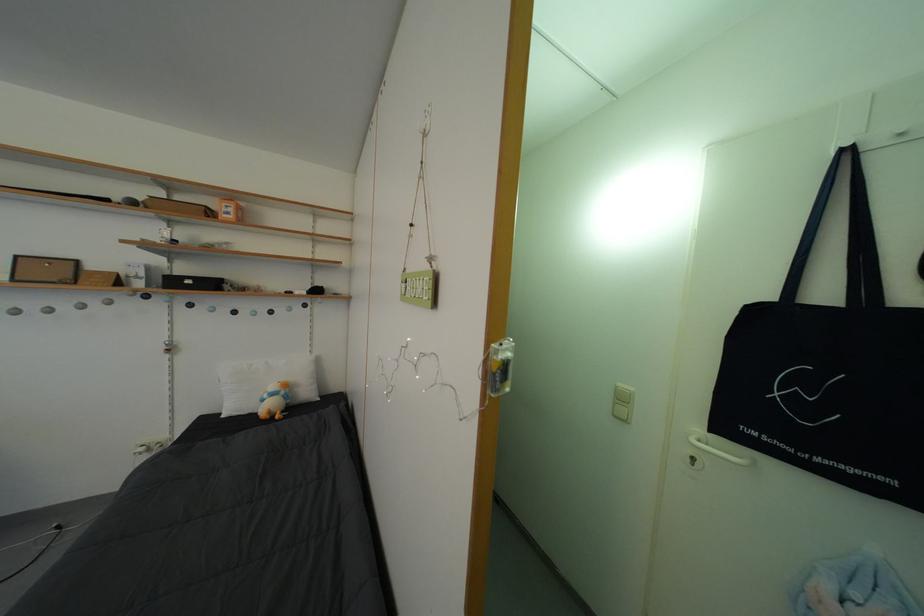
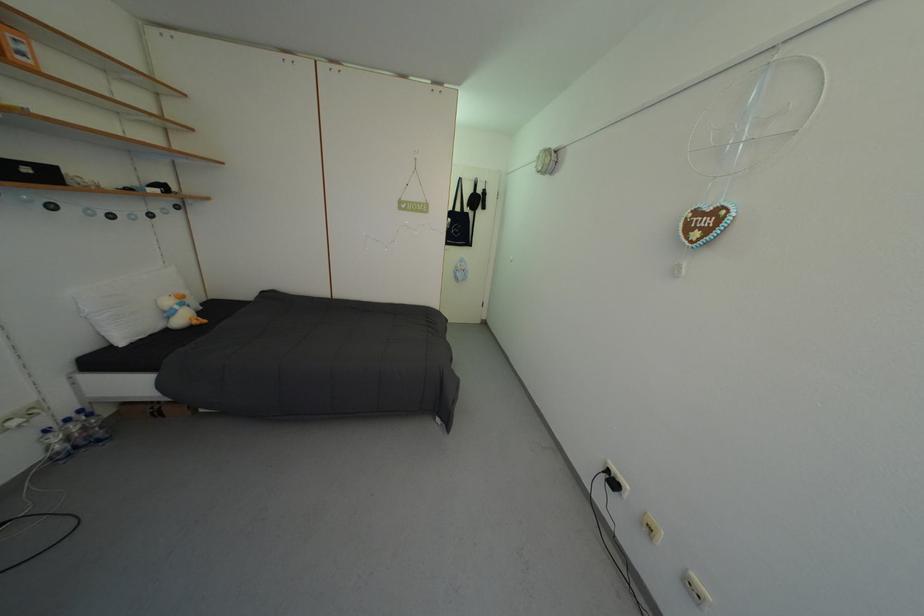
In the second image, find the point that corresponds to (x=198, y=288) in the first image.

(35, 176)